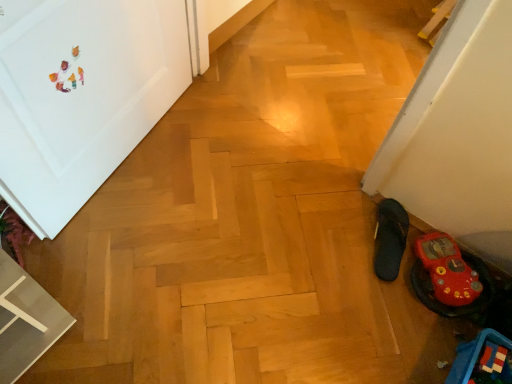
Question: Does blue plastic toy at lower right have a larger size compared to black fabric slipper at lower right, the 2th footwear viewed from the right?

Choices:
 (A) yes
 (B) no

Answer: (A)

Question: Does blue plastic toy at lower right touch black fabric slipper at lower right, the 2th footwear viewed from the right?

Choices:
 (A) yes
 (B) no

Answer: (B)

Question: Is the position of blue plastic toy at lower right more distant than that of black fabric slipper at lower right, positioned as the 1th footwear in left-to-right order?

Choices:
 (A) no
 (B) yes

Answer: (A)

Question: Is blue plastic toy at lower right thinner than black fabric slipper at lower right, the 2th footwear viewed from the right?

Choices:
 (A) no
 (B) yes

Answer: (B)

Question: Can you confirm if blue plastic toy at lower right is shorter than black fabric slipper at lower right, the 2th footwear viewed from the right?

Choices:
 (A) yes
 (B) no

Answer: (B)

Question: Considering the relative positions of black fabric slipper at lower right, positioned as the 1th footwear in left-to-right order, and blue plastic toy at lower right in the image provided, is black fabric slipper at lower right, positioned as the 1th footwear in left-to-right order, to the left or to the right of blue plastic toy at lower right?

Choices:
 (A) right
 (B) left

Answer: (B)

Question: In the image, is black fabric slipper at lower right, positioned as the 1th footwear in left-to-right order, positioned in front of or behind blue plastic toy at lower right?

Choices:
 (A) front
 (B) behind

Answer: (B)

Question: Is black fabric slipper at lower right, the 2th footwear viewed from the right, bigger or smaller than blue plastic toy at lower right?

Choices:
 (A) big
 (B) small

Answer: (B)

Question: From the image's perspective, relative to blue plastic toy at lower right, is black fabric slipper at lower right, the 2th footwear viewed from the right, above or below?

Choices:
 (A) above
 (B) below

Answer: (A)

Question: Is point (449, 380) closer or farther from the camera than point (429, 307)?

Choices:
 (A) farther
 (B) closer

Answer: (B)

Question: From a real-world perspective, is blue plastic toy at lower right above or below rubber flip-flop at lower right, which is the 2th footwear in left-to-right order?

Choices:
 (A) below
 (B) above

Answer: (B)

Question: From the image's perspective, is blue plastic toy at lower right located above or below rubber flip-flop at lower right, which is the 2th footwear in left-to-right order?

Choices:
 (A) below
 (B) above

Answer: (A)

Question: Based on their sizes in the image, would you say blue plastic toy at lower right is bigger or smaller than rubber flip-flop at lower right, acting as the 1th footwear starting from the right?

Choices:
 (A) small
 (B) big

Answer: (B)

Question: Considering the positions of rubber flip-flop at lower right, which is the 2th footwear in left-to-right order, and black fabric slipper at lower right, the 2th footwear viewed from the right, in the image, is rubber flip-flop at lower right, which is the 2th footwear in left-to-right order, wider or thinner than black fabric slipper at lower right, the 2th footwear viewed from the right,?

Choices:
 (A) thin
 (B) wide

Answer: (A)

Question: Is rubber flip-flop at lower right, acting as the 1th footwear starting from the right, in front of or behind black fabric slipper at lower right, positioned as the 1th footwear in left-to-right order, in the image?

Choices:
 (A) front
 (B) behind

Answer: (A)